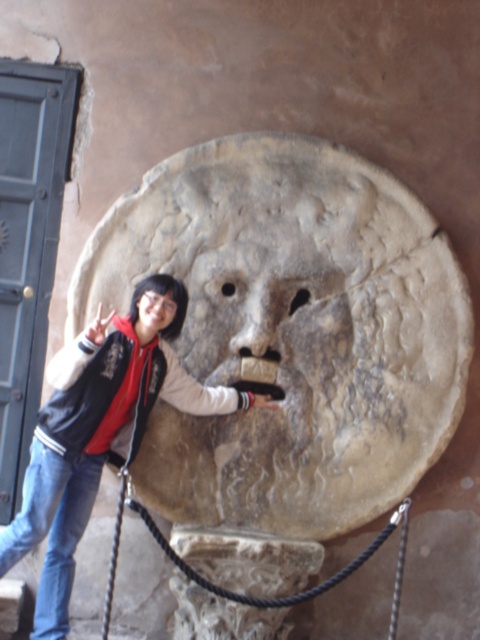
Does jeans at lower left have a smaller size compared to jeans at left?

No, jeans at lower left is not smaller than jeans at left.

Is point (111, 372) in front of point (36, 477)?

That is False.

At what (x,y) coordinates should I click in order to perform the action: click on jeans at lower left. Please return your answer as a coordinate pair (x, y). This screenshot has height=640, width=480. Looking at the image, I should click on (97, 435).

Is jeans at left positioned at the back of matte stone face at center?

That is False.

This screenshot has width=480, height=640. What do you see at coordinates (51, 529) in the screenshot?
I see `jeans at left` at bounding box center [51, 529].

At what (x,y) coordinates should I click in order to perform the action: click on jeans at left. Please return your answer as a coordinate pair (x, y). The width and height of the screenshot is (480, 640). Looking at the image, I should click on (51, 529).

Measure the distance between point (280, 413) and camera.

They are 11.38 meters apart.

Identify the location of gray stone face at center. This screenshot has height=640, width=480. (289, 330).

Identify the location of gray stone face at center. This screenshot has height=640, width=480. (289, 330).